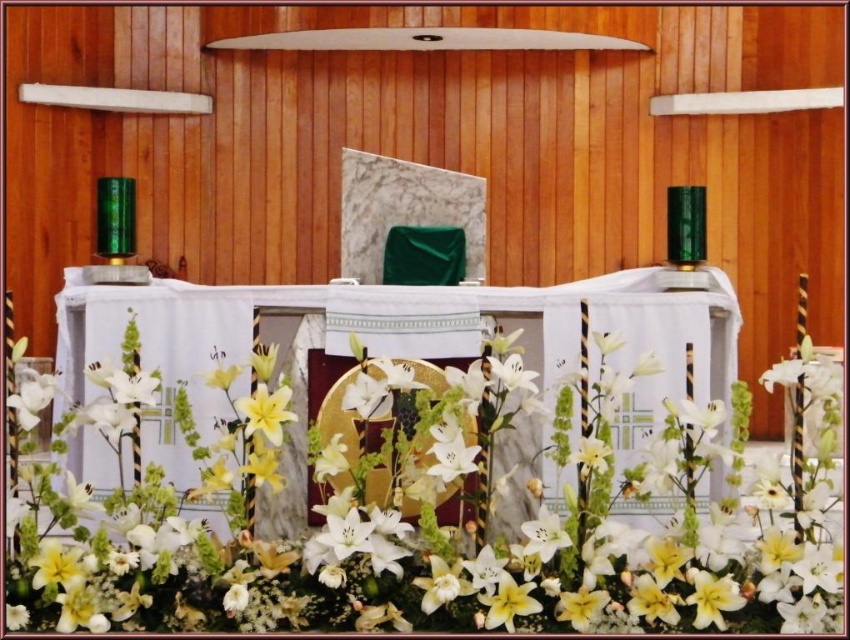
Between point (547, 426) and point (290, 392), which one is positioned in front?

Point (290, 392)

Locate an element on the screen. white fabric altar at center is located at coordinates (401, 356).

Where is `white fabric altar at center`? white fabric altar at center is located at coordinates (401, 356).

Which is above, white lilies at center or white fabric altar at center?

Positioned higher is white fabric altar at center.

Does white lilies at center have a lesser width compared to white fabric altar at center?

Incorrect, white lilies at center's width is not less than white fabric altar at center's.

Which is behind, point (34, 616) or point (166, 339)?

Point (166, 339)

Identify the location of white lilies at center. (431, 534).

Based on the photo, which of these two, white lilies at center or yellow matte lily at center, stands shorter?

Standing shorter between the two is yellow matte lily at center.

Is white lilies at center to the right of yellow matte lily at center from the viewer's perspective?

Yes, white lilies at center is to the right of yellow matte lily at center.

You are a GUI agent. You are given a task and a screenshot of the screen. Output one action in this format:
    pyautogui.click(x=<x>, y=<y>)
    Task: Click on the white lilies at center
    
    Given the screenshot: What is the action you would take?
    pyautogui.click(x=431, y=534)